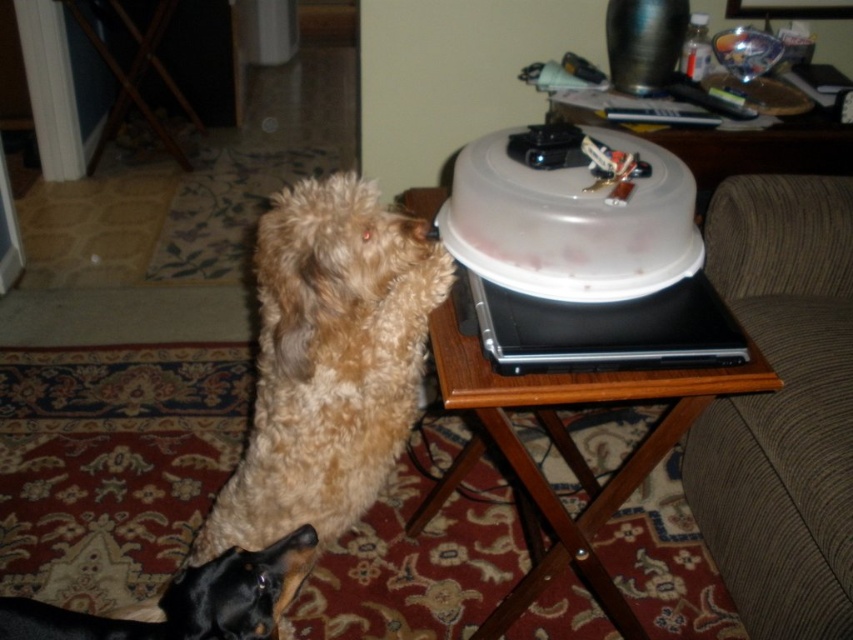
You are a photographer setting up a shoot in this room. You want to position a camera on the wooden side table at upper right to capture the fuzzy brown dog at center. Will the camera obstruct the dog from reaching the white plastic container on the laptop?

The fuzzy brown dog at center is above the wooden side table at upper right, so placing the camera on the table won t block the dog since the dog is already positioned higher than the table.

You are a dog owner who wants to place a new dog bed for the black shiny dog at lower left. Based on the scene, can the wooden side table at upper right accommodate the dog bed in terms of size?

The wooden side table at upper right has a larger size compared to the black shiny dog at lower left, so it can accommodate the dog bed as the table is bigger than the dog.